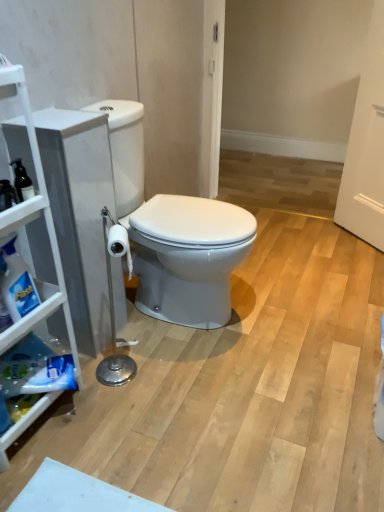
This screenshot has width=384, height=512. Identify the location of vacant point to the right of white glossy toilet at center. (294, 316).